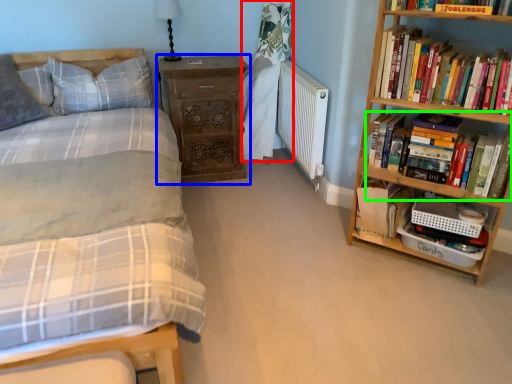
Question: Estimate the real-world distances between objects in this image. Which object is farther from curtain (highlighted by a red box), nightstand (highlighted by a blue box) or book (highlighted by a green box)?

Choices:
 (A) nightstand
 (B) book

Answer: (B)